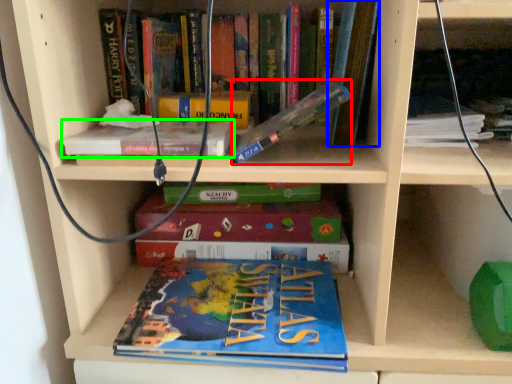
Question: Which object is the farthest from book (highlighted by a red box)? Choose among these: book (highlighted by a blue box) or book (highlighted by a green box).

Choices:
 (A) book
 (B) book

Answer: (B)